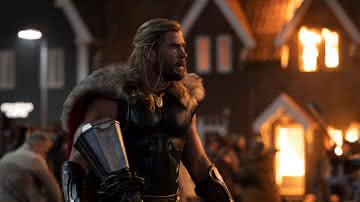
The image size is (360, 202). I want to click on door, so click(287, 154).